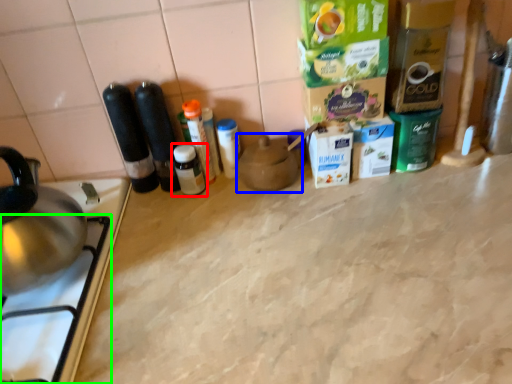
Question: Considering the real-world distances, which object is closest to bottle (highlighted by a red box)? appliance (highlighted by a blue box) or gas stove (highlighted by a green box).

Choices:
 (A) appliance
 (B) gas stove

Answer: (A)